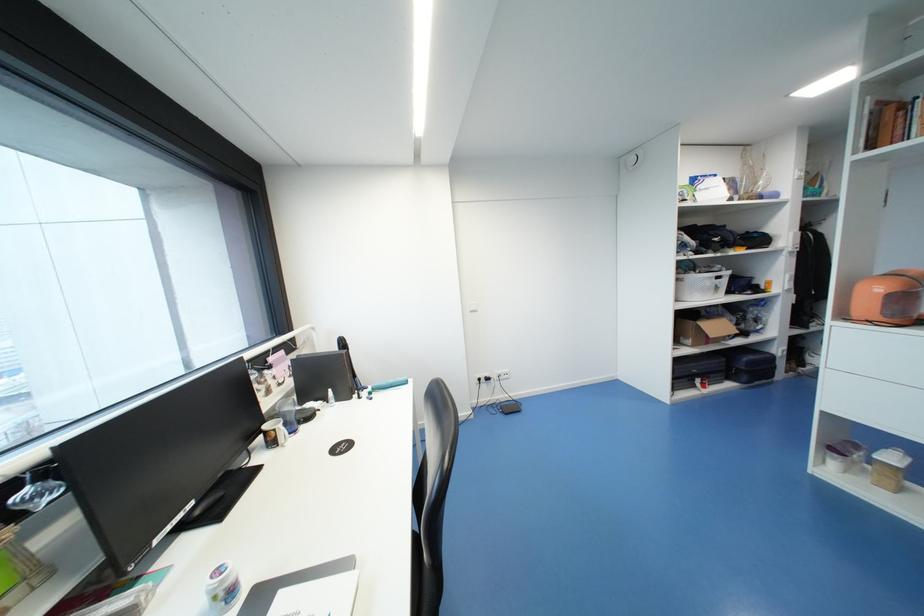
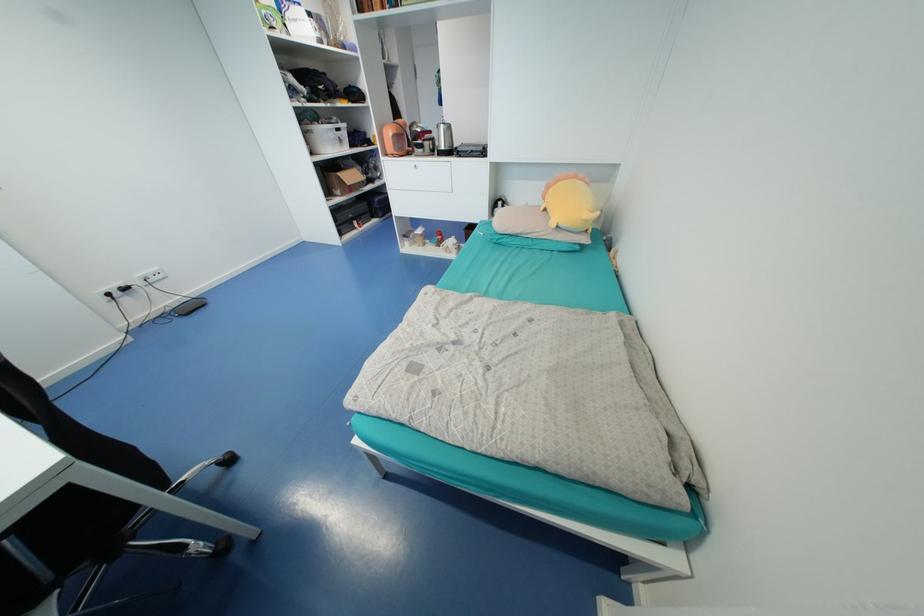
In the second image, find the point that corresponds to [881,290] in the first image.

(394, 132)